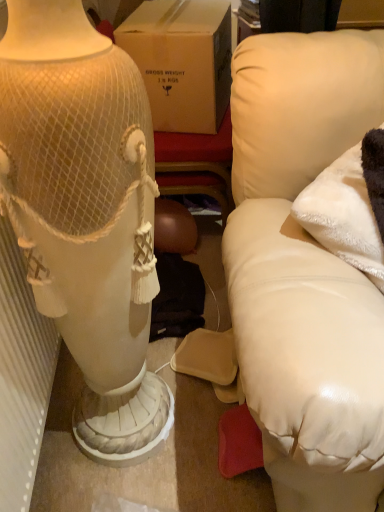
Question: Is white fluffy pillow at right not within white leather couch at right?

Choices:
 (A) no
 (B) yes

Answer: (A)

Question: Can white leather couch at right be found inside white fluffy pillow at right?

Choices:
 (A) no
 (B) yes

Answer: (A)

Question: Is white fluffy pillow at right with white leather couch at right?

Choices:
 (A) yes
 (B) no

Answer: (B)

Question: Considering the relative positions of white fluffy pillow at right and white leather couch at right in the image provided, is white fluffy pillow at right behind white leather couch at right?

Choices:
 (A) yes
 (B) no

Answer: (A)

Question: Is white fluffy pillow at right to the left of white leather couch at right from the viewer's perspective?

Choices:
 (A) yes
 (B) no

Answer: (B)

Question: From the image's perspective, is white textured radiator at left above or below white leather couch at right?

Choices:
 (A) above
 (B) below

Answer: (B)

Question: In the image, is white textured radiator at left positioned in front of or behind white leather couch at right?

Choices:
 (A) front
 (B) behind

Answer: (B)

Question: Looking at their shapes, would you say white textured radiator at left is wider or thinner than white leather couch at right?

Choices:
 (A) wide
 (B) thin

Answer: (B)

Question: Would you say white textured radiator at left is inside or outside white leather couch at right?

Choices:
 (A) inside
 (B) outside

Answer: (B)

Question: Looking at the image, does white leather couch at right seem bigger or smaller compared to white textured radiator at left?

Choices:
 (A) big
 (B) small

Answer: (A)

Question: Is white leather couch at right in front of or behind white textured radiator at left in the image?

Choices:
 (A) behind
 (B) front

Answer: (B)

Question: Is point (274, 479) positioned closer to the camera than point (59, 344)?

Choices:
 (A) farther
 (B) closer

Answer: (B)

Question: From a real-world perspective, is white leather couch at right above or below white textured radiator at left?

Choices:
 (A) above
 (B) below

Answer: (A)

Question: From their relative heights in the image, would you say white fluffy pillow at right is taller or shorter than white leather couch at right?

Choices:
 (A) short
 (B) tall

Answer: (A)

Question: Based on their sizes in the image, would you say white fluffy pillow at right is bigger or smaller than white leather couch at right?

Choices:
 (A) small
 (B) big

Answer: (A)